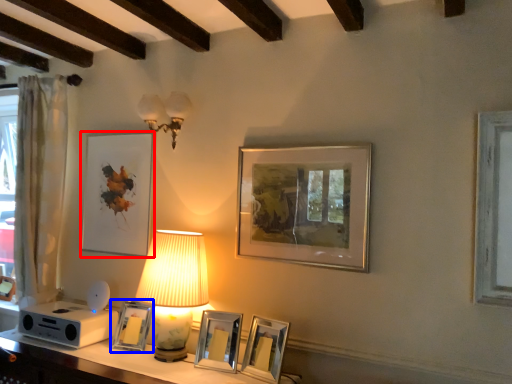
Question: Which point is closer to the camera, picture frame (highlighted by a red box) or picture frame (highlighted by a blue box)?

Choices:
 (A) picture frame
 (B) picture frame

Answer: (B)